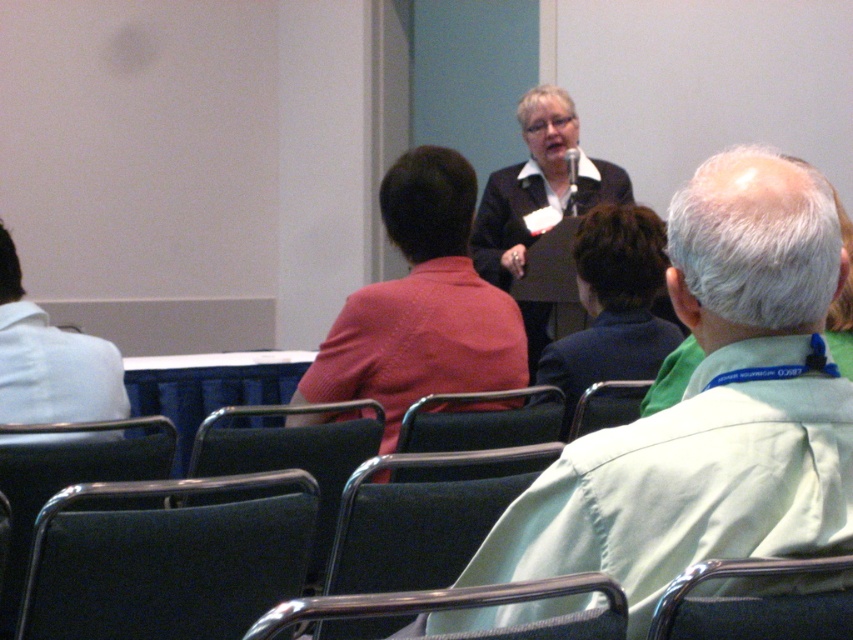
Question: Does black fabric chair at lower left come in front of dark blue fabric chair at lower left?

Choices:
 (A) yes
 (B) no

Answer: (A)

Question: Which point is farther to the camera?

Choices:
 (A) (224, 413)
 (B) (445, 291)
 (C) (68, 403)
 (D) (634, 385)

Answer: (D)

Question: Which object appears closest to the camera in this image?

Choices:
 (A) white fabric shirt at left
 (B) metallic silver chair at lower right
 (C) dark green fabric chair at center
 (D) black leather chair at center

Answer: (B)

Question: Which object appears closest to the camera in this image?

Choices:
 (A) dark blue fabric chair at lower left
 (B) black leather chair at center

Answer: (A)

Question: Can you confirm if white fabric shirt at left is positioned to the right of dark green fabric chair at center?

Choices:
 (A) yes
 (B) no

Answer: (B)

Question: From the image, what is the correct spatial relationship of matte black jacket at center in relation to dark blue fabric chair at lower left?

Choices:
 (A) right
 (B) left

Answer: (A)